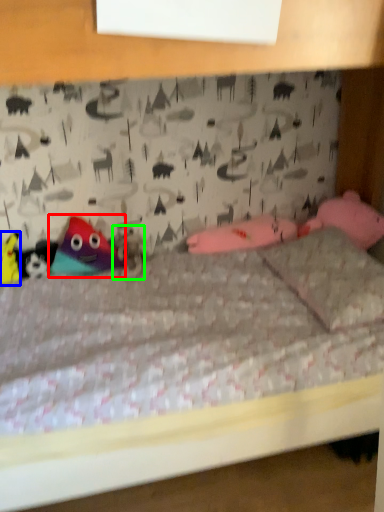
Question: Which object is the closest to the toy (highlighted by a red box)? Choose among these: toy (highlighted by a blue box) or animal (highlighted by a green box).

Choices:
 (A) toy
 (B) animal

Answer: (B)